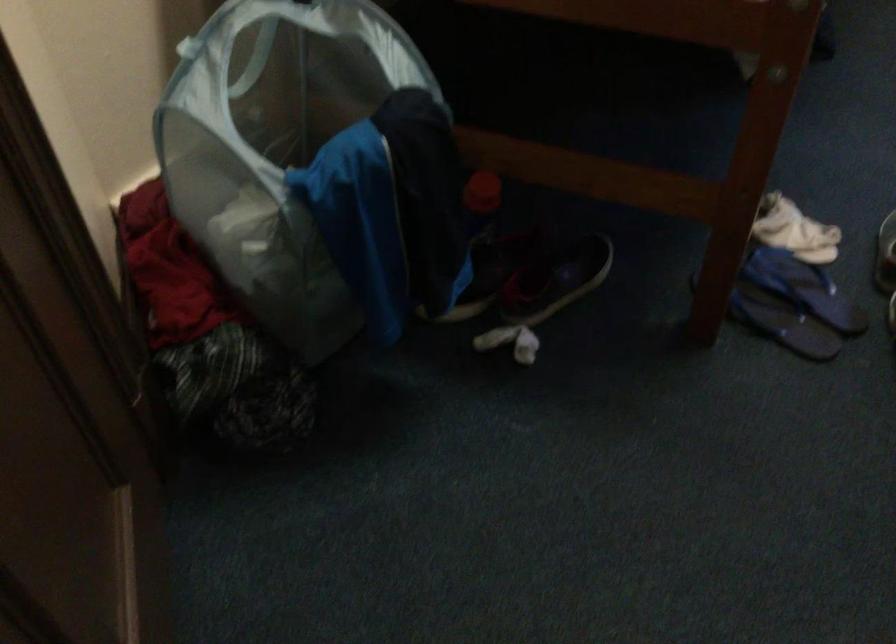
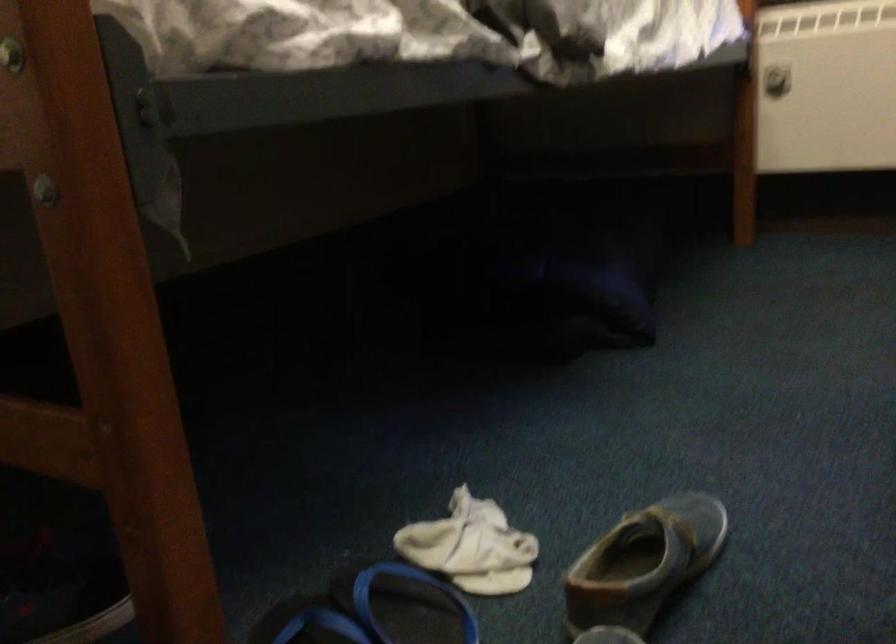
Locate, in the second image, the point that corresponds to [780,269] in the first image.

(406, 605)